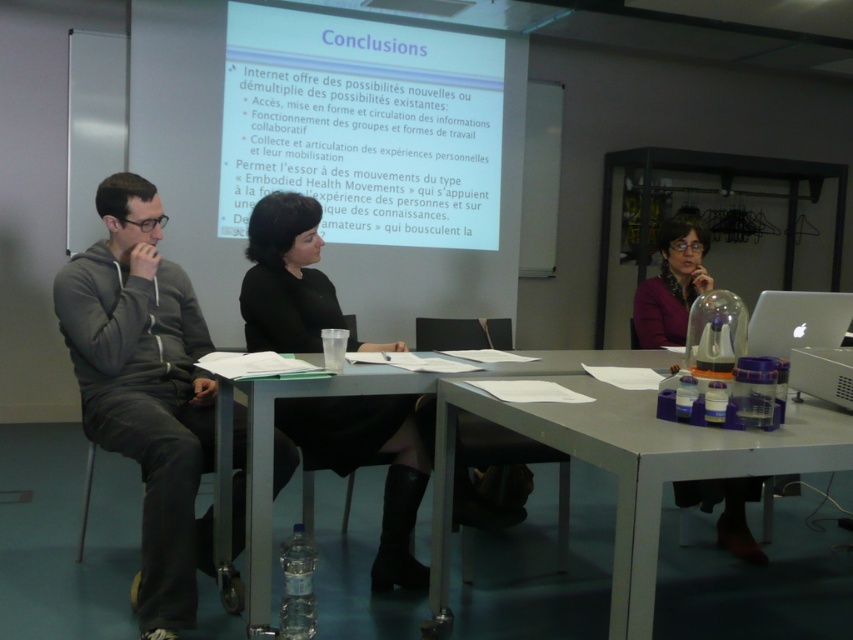
You are an event organizer who needs to hang a banner that is 1.5 meters tall. The banner must be placed above the white matte projector screen at upper center and the purple matte jacket at center. Based on their heights, will the banner fit without overlapping either object?

The white matte projector screen at upper center is taller than the purple matte jacket at center. Since the banner is 1.5 meters tall, it can be placed above the taller object, the white matte projector screen at upper center, ensuring it doesn

You are sitting at the table in the conference room and want to grab your gray hoodie at left without moving your chair. Can you reach it while keeping an eye on the white matte projector screen at upper center?

The gray hoodie at left is closer to you than the white matte projector screen at upper center, so you can easily reach it without moving your chair while still being able to see the screen.